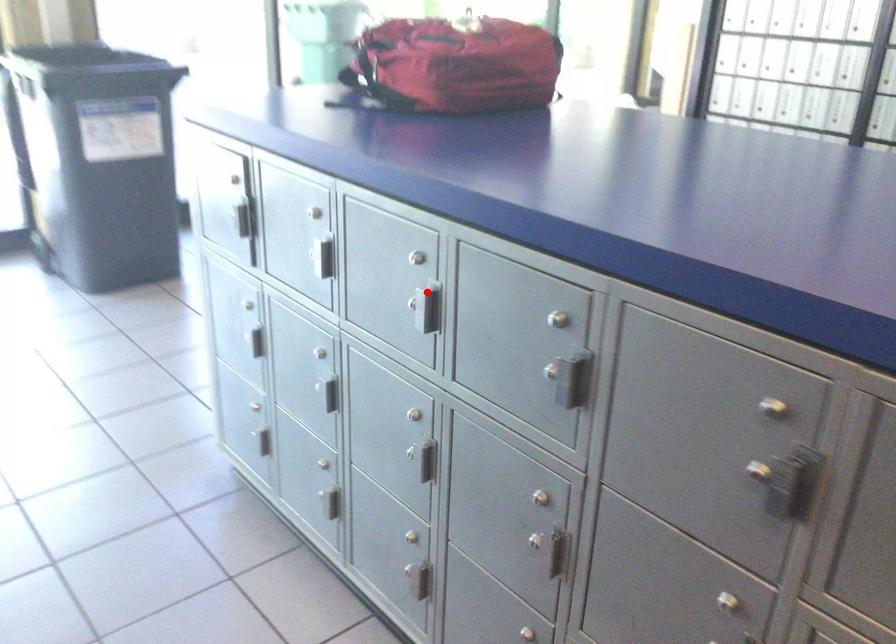
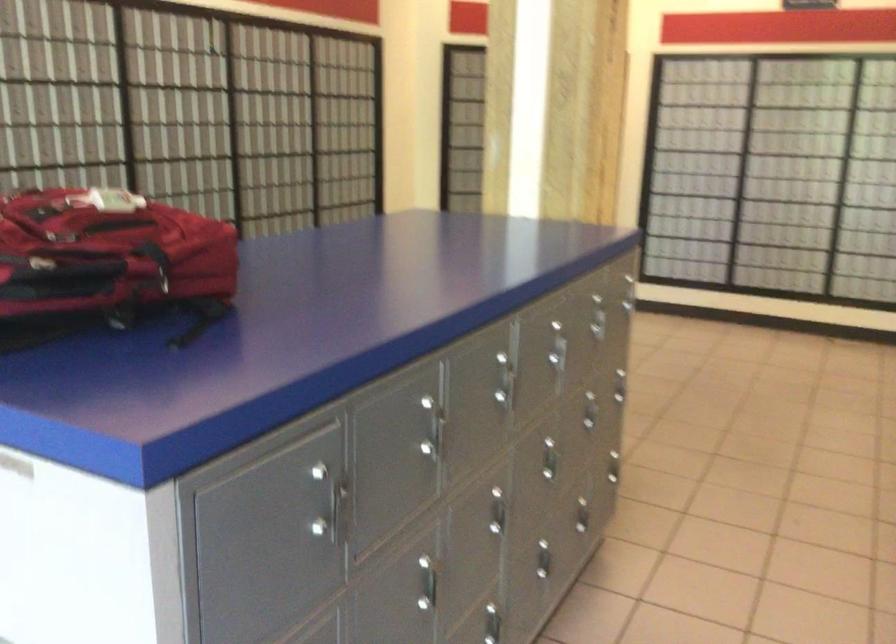
Find the pixel in the second image that matches the highlighted location in the first image.

(503, 381)